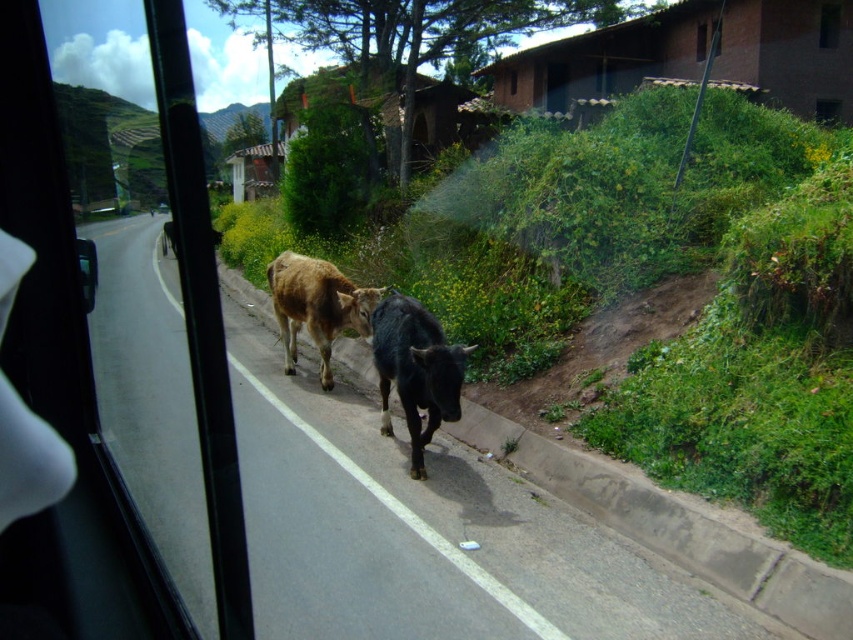
Question: Does transparent glass car window at left have a smaller size compared to black glossy cow at center?

Choices:
 (A) yes
 (B) no

Answer: (B)

Question: In this image, where is transparent glass car window at left located relative to black glossy cow at center?

Choices:
 (A) left
 (B) right

Answer: (A)

Question: Does transparent glass car window at left have a larger size compared to black glossy cow at center?

Choices:
 (A) yes
 (B) no

Answer: (A)

Question: Among these points, which one is farthest from the camera?

Choices:
 (A) (280, 320)
 (B) (122, 406)
 (C) (393, 372)

Answer: (A)

Question: Which object appears closest to the camera in this image?

Choices:
 (A) transparent glass car window at left
 (B) brown glossy cow at center

Answer: (A)

Question: Which point is closer to the camera?

Choices:
 (A) (367, 310)
 (B) (225, 474)
 (C) (405, 397)

Answer: (C)